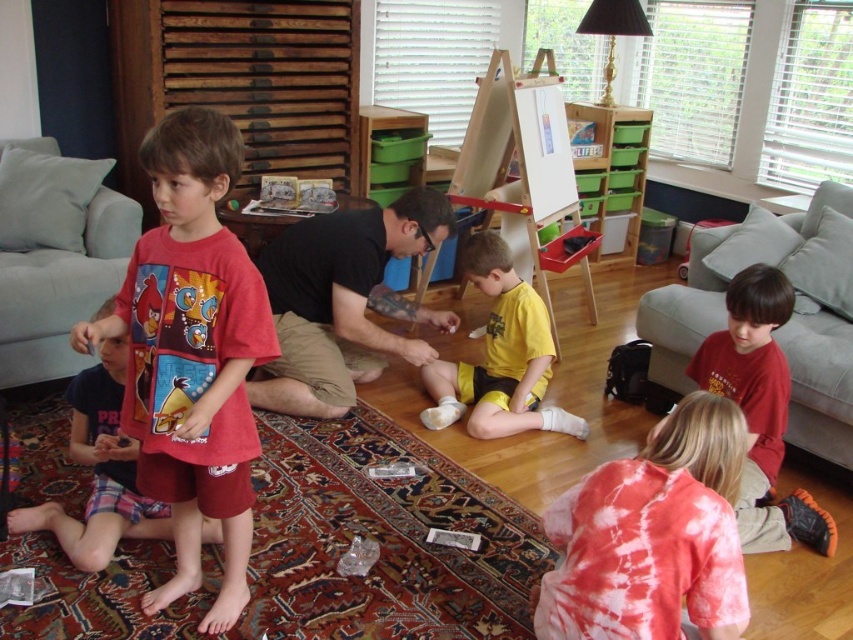
Based on the photo, you are a photographer standing at the camera position. You want to take a closeup photo of the yellow matte shorts at center. Can you reach it with your 2 meter long extendable pole?

The yellow matte shorts at center is 2.94 meters from camera. The extendable pole is only 2 meters long, so it is not long enough to reach the yellow matte shorts at center.